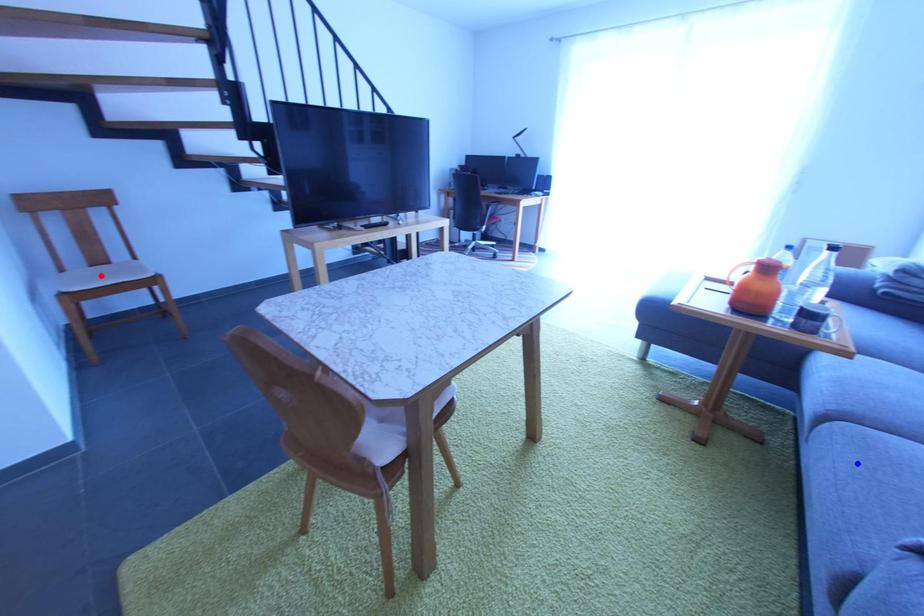
Question: Which of the two points in the image is closer to the camera?

Choices:
 (A) Blue point is closer.
 (B) Red point is closer.

Answer: (A)